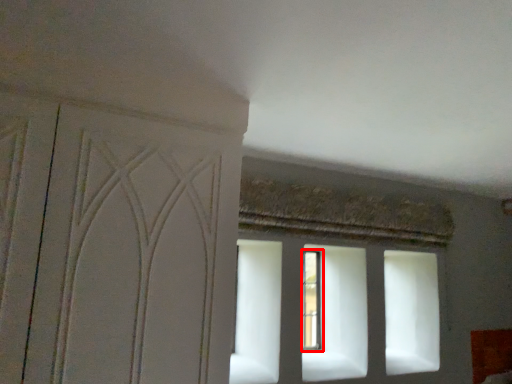
Question: From the image's perspective, what is the correct spatial positioning of window (annotated by the red box) in reference to screen door?

Choices:
 (A) below
 (B) above

Answer: (A)